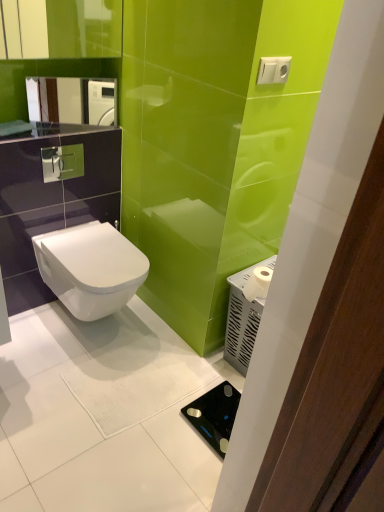
What are the coordinates of `vacant area on top of white glossy toilet at center (from a real-world perspective)` in the screenshot? It's located at (100, 249).